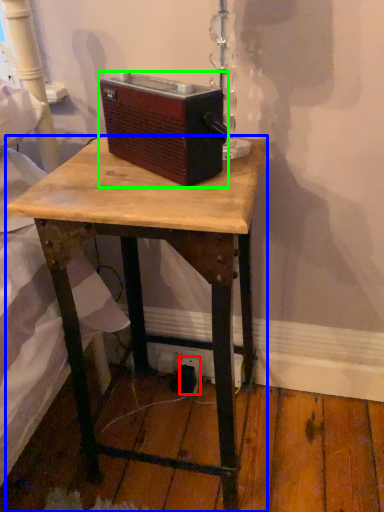
Question: Which object is the closest to the electric outlet (highlighted by a red box)? Choose among these: desk (highlighted by a blue box) or gadget (highlighted by a green box).

Choices:
 (A) desk
 (B) gadget

Answer: (A)